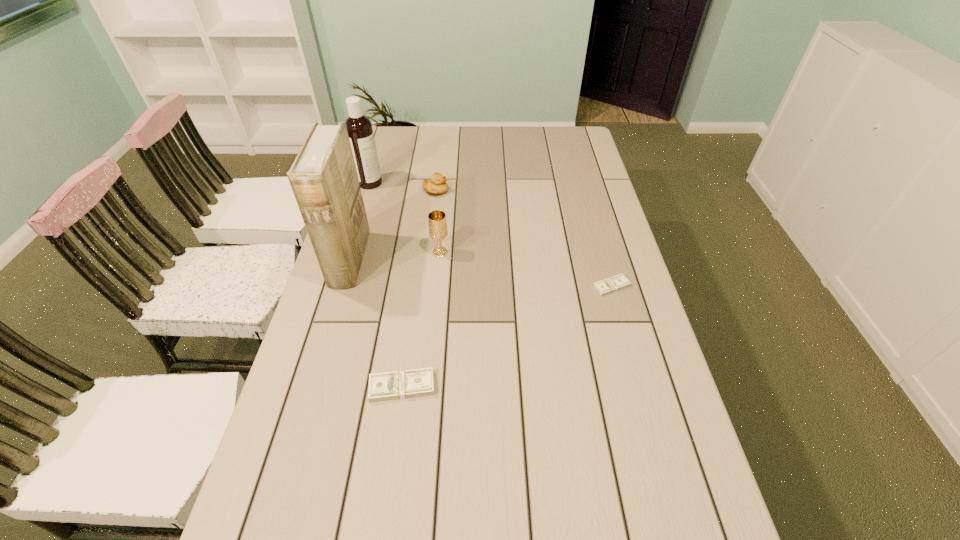
This screenshot has width=960, height=540. I want to click on free space located 0.310m on the front-facing side of the fourth tallest object, so click(x=534, y=191).

Locate an element on the screen. The height and width of the screenshot is (540, 960). free space located on the label side of the fifth shortest object is located at coordinates (428, 183).

Locate an element on the screen. vacant region located 0.190m on the right of the fourth shortest object is located at coordinates (511, 253).

The image size is (960, 540). Find the location of `vacant point located on the cover of the phonebook`. vacant point located on the cover of the phonebook is located at coordinates (403, 260).

Where is `dishwasher detergent that is at the left edge`? The height and width of the screenshot is (540, 960). dishwasher detergent that is at the left edge is located at coordinates (360, 131).

The image size is (960, 540). Identify the location of phonebook located at the left edge. (323, 177).

What are the coordinates of `object located at the right edge` in the screenshot? It's located at (618, 282).

Locate an element on the screen. The image size is (960, 540). vacant space at the far edge is located at coordinates (473, 128).

Image resolution: width=960 pixels, height=540 pixels. I want to click on free space at the left edge, so click(382, 199).

In the image, there is a desktop. Where is `free space at the right edge`? The height and width of the screenshot is (540, 960). free space at the right edge is located at coordinates (591, 241).